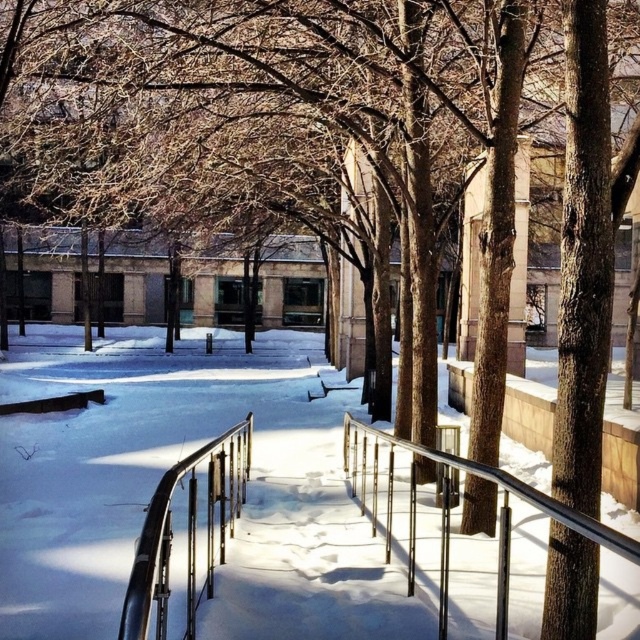
Measure the distance between point [225,580] and camera.

They are 15.52 feet apart.

Is white powdery snow at center to the left of metallic silver railing at center from the viewer's perspective?

Yes, white powdery snow at center is to the left of metallic silver railing at center.

Is point (147, 353) positioned behind point (385, 544)?

Yes, it is behind point (385, 544).

This screenshot has height=640, width=640. I want to click on white powdery snow at center, so click(x=168, y=467).

Who is lower down, black metal railing at center or metallic silver railing at center?

black metal railing at center is lower down.

Between point (189, 618) and point (353, 461), which one is positioned in front?

Positioned in front is point (189, 618).

Who is more forward, (218, 524) or (378, 440)?

Positioned in front is point (218, 524).

Find the location of `black metal railing at center`. black metal railing at center is located at coordinates (186, 538).

Is point (176, 353) closer to camera compared to point (134, 618)?

No, (176, 353) is behind (134, 618).

Can you confirm if white powdery snow at center is taller than black metal railing at center?

Correct, white powdery snow at center is much taller as black metal railing at center.

Does point (115, 618) come farther from viewer compared to point (221, 484)?

No.

I want to click on white powdery snow at center, so click(168, 467).